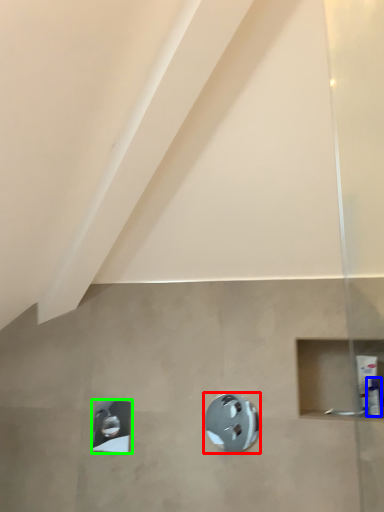
Question: Which object is the farthest from shower (highlighted by a red box)? Choose among these: toiletry (highlighted by a blue box) or shower (highlighted by a green box).

Choices:
 (A) toiletry
 (B) shower

Answer: (A)